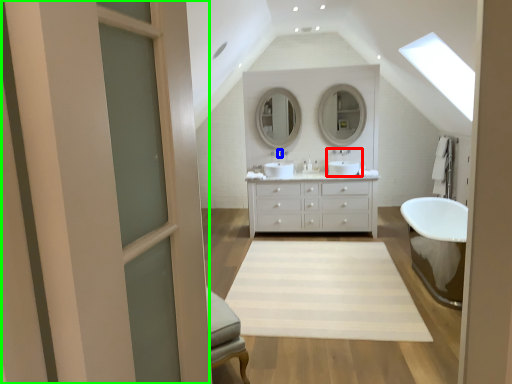
Question: Which object is positioned farthest from sink (highlighted by a red box)? Select from faucet (highlighted by a blue box) and screen door (highlighted by a green box).

Choices:
 (A) faucet
 (B) screen door

Answer: (B)